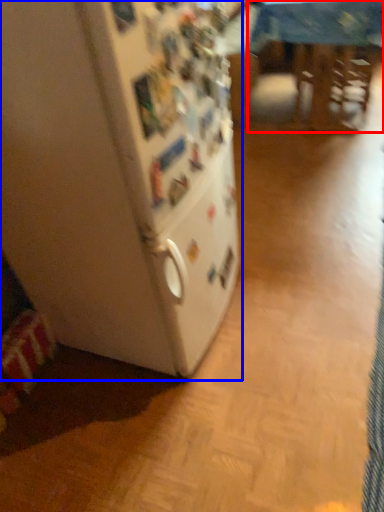
Question: Which point is further to the camera, table (highlighted by a red box) or refrigerator (highlighted by a blue box)?

Choices:
 (A) table
 (B) refrigerator

Answer: (A)